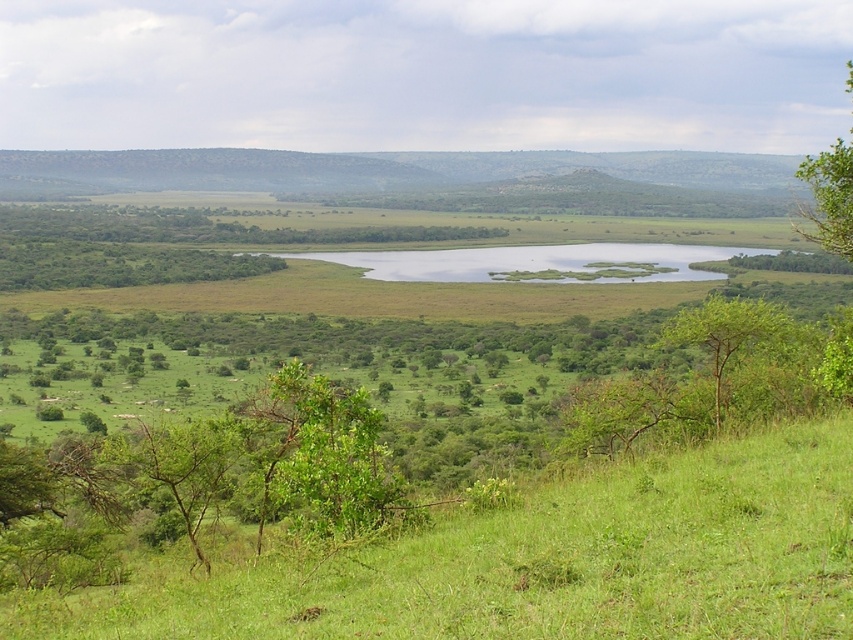
Question: Is green leafy tree at center behind green leafy tree at lower right?

Choices:
 (A) yes
 (B) no

Answer: (B)

Question: Based on their relative distances, which object is farther from the green grassy lake at center?

Choices:
 (A) green leafy tree at lower left
 (B) green grassy at lower center
 (C) green leafy tree at upper right
 (D) green leafy tree at center

Answer: (D)

Question: Which is farther from the green leafy tree at lower right?

Choices:
 (A) green leafy tree at center
 (B) green leafy tree at upper right

Answer: (B)

Question: Does green leafy tree at center come behind green leafy tree at lower right?

Choices:
 (A) yes
 (B) no

Answer: (B)

Question: Is green grassy lake at center wider than green leafy tree at lower left?

Choices:
 (A) yes
 (B) no

Answer: (A)

Question: Which point is closer to the camera?

Choices:
 (A) (543, 278)
 (B) (786, 321)
 (C) (224, 460)

Answer: (C)